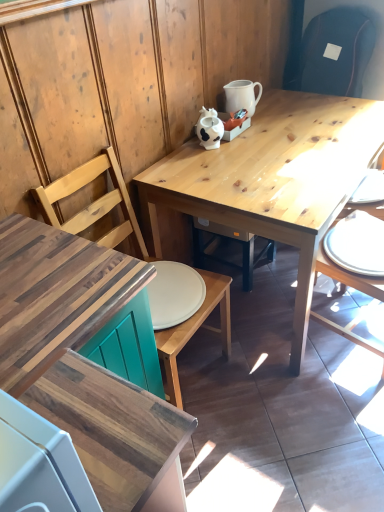
Locate an element on the screen. This screenshot has width=384, height=512. vacant area that is in front of wooden chair at right, which is the 2th chair in left-to-right order is located at coordinates (340, 400).